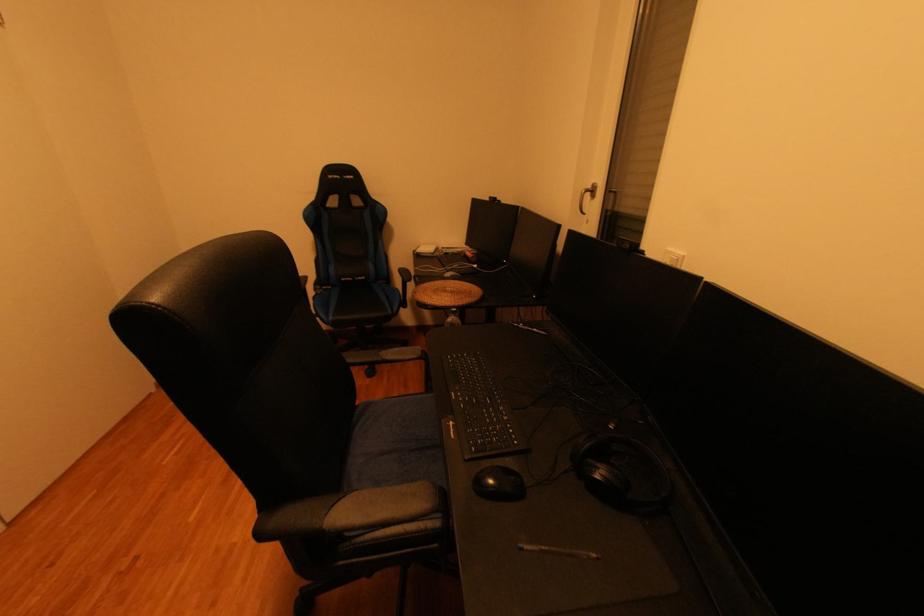
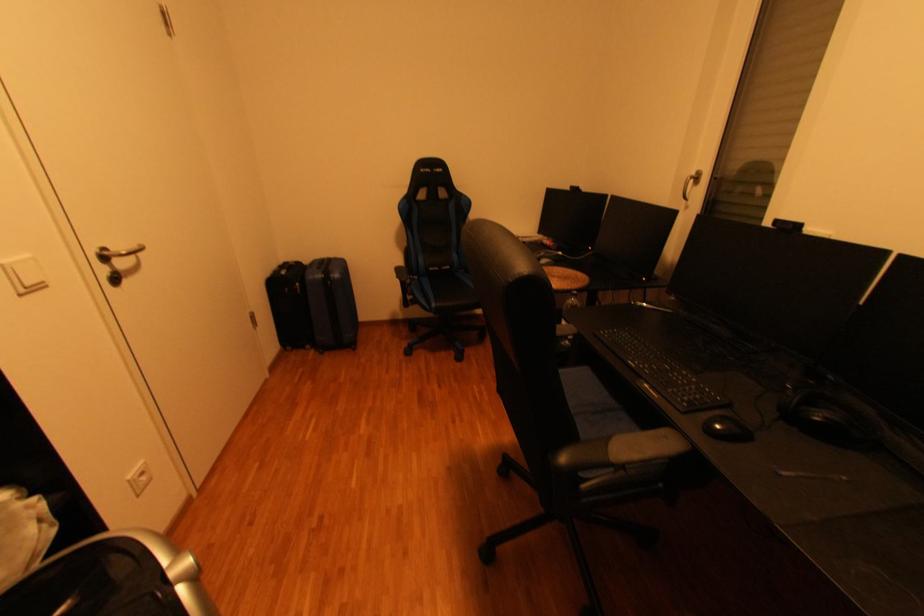
Question: What movement of the cameraman would produce the second image?

Choices:
 (A) Left
 (B) Right
 (C) Forward
 (D) Backward

Answer: (A)